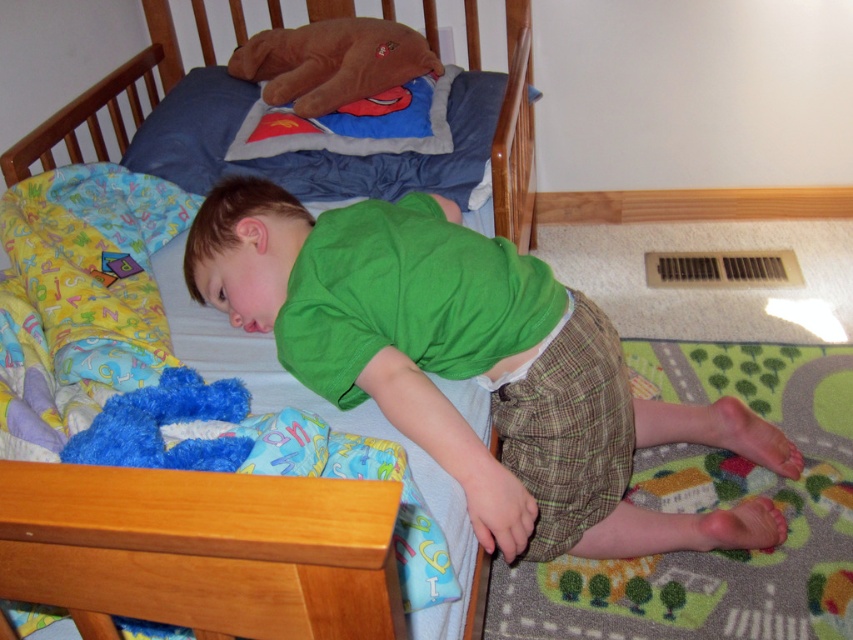
You are a parent trying to find your child a toy. You see the fuzzy blue stuffed animal at lower left and the wooden crib at upper left. Which object is closer to you?

The wooden crib at upper left is closer to you because the fuzzy blue stuffed animal at lower left is behind it.

You are a parent checking on your child. You notice the green cotton shirt at center and the fuzzy blue stuffed animal at lower left. Which object is closer to you?

The green cotton shirt at center is closer to you because the fuzzy blue stuffed animal at lower left is behind it.